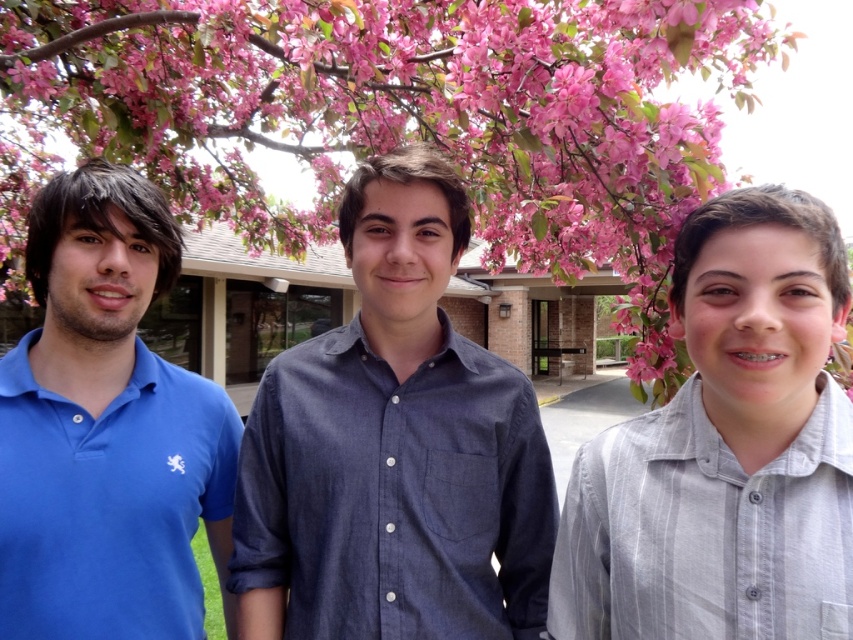
Who is more forward, (x=625, y=200) or (x=410, y=483)?

Positioned in front is point (x=410, y=483).

Can you confirm if pink blossoms at upper center is smaller than blue cotton polo shirt at center?

Incorrect, pink blossoms at upper center is not smaller in size than blue cotton polo shirt at center.

At what (x,y) coordinates should I click in order to perform the action: click on pink blossoms at upper center. Please return your answer as a coordinate pair (x, y). This screenshot has height=640, width=853. Looking at the image, I should click on (396, 115).

At what (x,y) coordinates should I click in order to perform the action: click on pink blossoms at upper center. Please return your answer as a coordinate pair (x, y). The height and width of the screenshot is (640, 853). Looking at the image, I should click on 396,115.

Does gray striped shirt at center have a smaller size compared to blue cotton polo shirt at center?

Correct, gray striped shirt at center occupies less space than blue cotton polo shirt at center.

Is point (674, 445) closer to camera compared to point (361, 342)?

Yes, point (674, 445) is in front of point (361, 342).

Find the location of a particular element. The image size is (853, 640). gray striped shirt at center is located at coordinates (724, 449).

Identify the location of gray striped shirt at center. (724, 449).

Can you confirm if gray striped shirt at center is positioned to the right of matte blue polo shirt at left?

Yes, gray striped shirt at center is to the right of matte blue polo shirt at left.

Is point (598, 442) positioned behind point (114, 406)?

That is False.

Locate an element on the screen. The height and width of the screenshot is (640, 853). gray striped shirt at center is located at coordinates (724, 449).